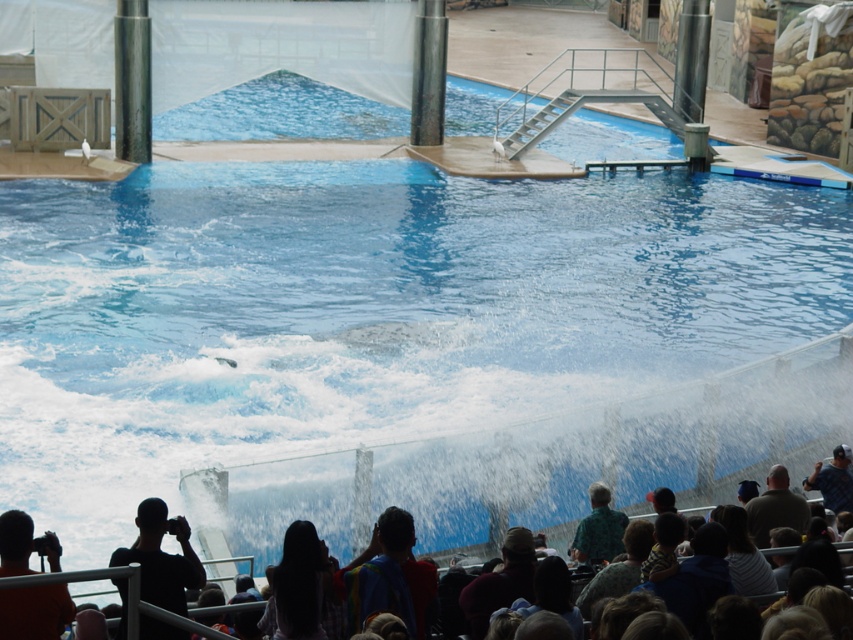
Question: Estimate the real-world distances between objects in this image. Which object is farther from the orange shirt at lower left?

Choices:
 (A) multicolored fabric at lower center
 (B) brown fabric hat at lower center
 (C) silhouette clothing crowd at lower center

Answer: (B)

Question: Is black matte camera at lower left wider than silky black hair at lower center?

Choices:
 (A) no
 (B) yes

Answer: (B)

Question: Which point appears closest to the camera in this image?

Choices:
 (A) (0, 570)
 (B) (311, 554)
 (C) (149, 595)
 (D) (514, 544)

Answer: (A)

Question: Does black matte camera at lower left have a greater width compared to dark brown leather jacket at lower right?

Choices:
 (A) yes
 (B) no

Answer: (B)

Question: Which point is farther from the camera taking this photo?

Choices:
 (A) (426, 586)
 (B) (817, 474)
 (C) (305, 625)
 (D) (788, 520)

Answer: (B)

Question: Does orange shirt at lower left have a larger size compared to dark brown leather jacket at lower right?

Choices:
 (A) yes
 (B) no

Answer: (B)